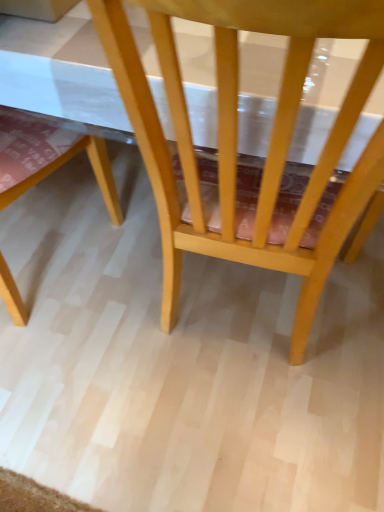
Measure the distance between light wood chair at center, which is the 2th chair from left to right, and camera.

light wood chair at center, which is the 2th chair from left to right, is 36.33 centimeters from camera.

Find the location of a particular element. Image resolution: width=384 pixels, height=512 pixels. light wood chair at center, which is the 2th chair from left to right is located at coordinates (237, 135).

Measure the distance between point (293,81) and camera.

Point (293,81) is 46.40 centimeters away from camera.

Describe the element at coordinates (237, 135) in the screenshot. I see `light wood chair at center, the first chair positioned from the right` at that location.

This screenshot has width=384, height=512. What do you see at coordinates (47, 156) in the screenshot?
I see `light wood chair at lower left, the first chair from the left` at bounding box center [47, 156].

In order to click on light wood chair at lower left, the second chair in the right-to-left sequence in this screenshot , I will do `click(47, 156)`.

I want to click on light wood chair at center, the first chair positioned from the right, so click(237, 135).

Between light wood chair at lower left, the second chair in the right-to-left sequence, and light wood chair at center, which is the 2th chair from left to right, which one appears on the left side from the viewer's perspective?

light wood chair at lower left, the second chair in the right-to-left sequence, is more to the left.

Is light wood chair at lower left, the second chair in the right-to-left sequence, in front of or behind light wood chair at center, which is the 2th chair from left to right, in the image?

Clearly, light wood chair at lower left, the second chair in the right-to-left sequence, is behind light wood chair at center, which is the 2th chair from left to right.

Is point (43, 140) farther from viewer compared to point (296, 311)?

No, it is not.

From the image's perspective, which is below, light wood chair at lower left, the second chair in the right-to-left sequence, or light wood chair at center, which is the 2th chair from left to right?

light wood chair at lower left, the second chair in the right-to-left sequence, from the image's perspective.

From a real-world perspective, relative to light wood chair at center, which is the 2th chair from left to right, is light wood chair at lower left, the first chair from the left, vertically above or below?

light wood chair at lower left, the first chair from the left, is below light wood chair at center, which is the 2th chair from left to right.

Looking at their sizes, would you say light wood chair at lower left, the first chair from the left, is wider or thinner than light wood chair at center, the first chair positioned from the right?

light wood chair at lower left, the first chair from the left, is thinner than light wood chair at center, the first chair positioned from the right.

Is light wood chair at lower left, the first chair from the left, taller than light wood chair at center, which is the 2th chair from left to right?

No.

Between light wood chair at lower left, the first chair from the left, and light wood chair at center, the first chair positioned from the right, which one has smaller size?

light wood chair at lower left, the first chair from the left, is smaller.

Would you say light wood chair at lower left, the second chair in the right-to-left sequence, is outside light wood chair at center, the first chair positioned from the right?

No, light wood chair at lower left, the second chair in the right-to-left sequence, is not outside of light wood chair at center, the first chair positioned from the right.

Is light wood chair at lower left, the first chair from the left, with light wood chair at center, which is the 2th chair from left to right?

light wood chair at lower left, the first chair from the left, and light wood chair at center, which is the 2th chair from left to right, are clearly separated.

Is light wood chair at lower left, the first chair from the left, facing away from light wood chair at center, the first chair positioned from the right?

Yes.

The height and width of the screenshot is (512, 384). What are the coordinates of `chair that is above the light wood chair at lower left, the second chair in the right-to-left sequence (from a real-world perspective)` in the screenshot? It's located at (237, 135).

Which object is positioned more to the left, light wood chair at center, the first chair positioned from the right, or light wood chair at lower left, the second chair in the right-to-left sequence?

Positioned to the left is light wood chair at lower left, the second chair in the right-to-left sequence.

Does light wood chair at center, which is the 2th chair from left to right, lie behind light wood chair at lower left, the first chair from the left?

That is False.

Does point (221, 69) come farther from viewer compared to point (34, 137)?

No, (221, 69) is closer to viewer.

From the image's perspective, is light wood chair at center, the first chair positioned from the right, above or below light wood chair at lower left, the second chair in the right-to-left sequence?

Clearly, from the image's perspective, light wood chair at center, the first chair positioned from the right, is above light wood chair at lower left, the second chair in the right-to-left sequence.

From a real-world perspective, who is located higher, light wood chair at center, the first chair positioned from the right, or light wood chair at lower left, the second chair in the right-to-left sequence?

light wood chair at center, the first chair positioned from the right, from a real-world perspective.

Which object is wider, light wood chair at center, the first chair positioned from the right, or light wood chair at lower left, the second chair in the right-to-left sequence?

With larger width is light wood chair at center, the first chair positioned from the right.

From their relative heights in the image, would you say light wood chair at center, which is the 2th chair from left to right, is taller or shorter than light wood chair at lower left, the second chair in the right-to-left sequence?

Clearly, light wood chair at center, which is the 2th chair from left to right, is taller compared to light wood chair at lower left, the second chair in the right-to-left sequence.

Which of these two, light wood chair at center, which is the 2th chair from left to right, or light wood chair at lower left, the first chair from the left, is bigger?

With larger size is light wood chair at center, which is the 2th chair from left to right.

Choose the correct answer: Is light wood chair at center, the first chair positioned from the right, inside light wood chair at lower left, the first chair from the left, or outside it?

light wood chair at center, the first chair positioned from the right, exists outside the volume of light wood chair at lower left, the first chair from the left.

Is light wood chair at center, which is the 2th chair from left to right, far from light wood chair at lower left, the second chair in the right-to-left sequence?

No, light wood chair at center, which is the 2th chair from left to right, is not far away from light wood chair at lower left, the second chair in the right-to-left sequence.

Consider the image. Is light wood chair at center, the first chair positioned from the right, positioned with its back to light wood chair at lower left, the first chair from the left?

That's right, light wood chair at center, the first chair positioned from the right, is facing away from light wood chair at lower left, the first chair from the left.

How different are the orientations of light wood chair at center, which is the 2th chair from left to right, and light wood chair at lower left, the second chair in the right-to-left sequence, in degrees?

165 degrees separate the facing orientations of light wood chair at center, which is the 2th chair from left to right, and light wood chair at lower left, the second chair in the right-to-left sequence.

What are the coordinates of `chair on the left of light wood chair at center, the first chair positioned from the right` in the screenshot? It's located at (47, 156).

This screenshot has height=512, width=384. Find the location of `chair lying on the right of light wood chair at lower left, the first chair from the left`. chair lying on the right of light wood chair at lower left, the first chair from the left is located at coordinates (237, 135).

Locate an element on the screen. This screenshot has height=512, width=384. chair that appears behind the light wood chair at center, which is the 2th chair from left to right is located at coordinates (47, 156).